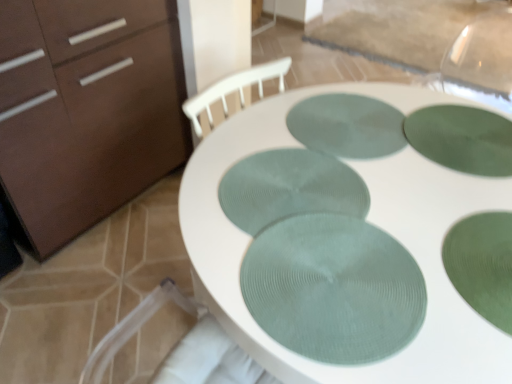
The height and width of the screenshot is (384, 512). Identify the location of vacant region above green textured glass plate at center, placed as the fifth glass plate when sorted from back to front (from a real-world perspective). tap(332, 279).